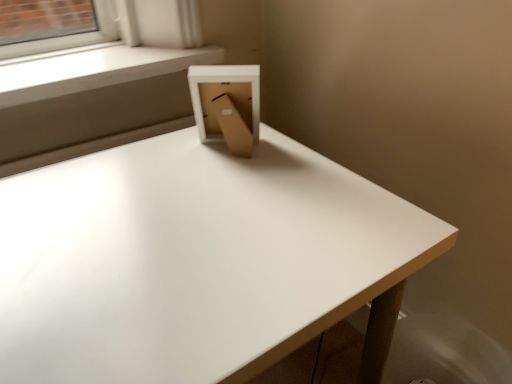
Locate an element on the screen. Image resolution: width=512 pixels, height=384 pixels. white smooth window sill at upper left is located at coordinates (94, 70).

Measure the distance between white smooth window sill at upper left and camera.

white smooth window sill at upper left and camera are 36.36 inches apart from each other.

In order to face cardboard box at center, should I rotate leftwards or rightwards?

To align with it, rotate left about 3.703°.

Identify the location of white smooth window sill at upper left. (94, 70).

Which is more distant, (18, 289) or (84, 84)?

Point (84, 84)

From the picture: Considering the relative positions of white matte table at center and white smooth window sill at upper left in the image provided, is white matte table at center to the left or to the right of white smooth window sill at upper left?

white matte table at center is to the right of white smooth window sill at upper left.

Can you confirm if white matte table at center is taller than white smooth window sill at upper left?

Indeed, white matte table at center has a greater height compared to white smooth window sill at upper left.

How many degrees apart are the facing directions of cardboard box at center and white smooth window sill at upper left?

143 degrees separate the facing orientations of cardboard box at center and white smooth window sill at upper left.

Is cardboard box at center next to white smooth window sill at upper left and touching it?

cardboard box at center is not next to white smooth window sill at upper left, and they're not touching.

Which is in front, point (205, 132) or point (95, 50)?

The point (205, 132) is closer.

Is cardboard box at center situated inside white smooth window sill at upper left or outside?

cardboard box at center cannot be found inside white smooth window sill at upper left.

In the scene shown: Does white smooth window sill at upper left come in front of white matte table at center?

No, white smooth window sill at upper left is further to the viewer.

Between white smooth window sill at upper left and white matte table at center, which one has smaller width?

Thinner between the two is white smooth window sill at upper left.

Is white smooth window sill at upper left smaller than white matte table at center?

Yes.

Is white smooth window sill at upper left not near cardboard box at center?

No, white smooth window sill at upper left is in close proximity to cardboard box at center.

Is point (84, 53) closer to viewer compared to point (206, 93)?

No, (84, 53) is behind (206, 93).

From the image's perspective, is white smooth window sill at upper left positioned above or below cardboard box at center?

Clearly, from the image's perspective, white smooth window sill at upper left is above cardboard box at center.

Between white smooth window sill at upper left and cardboard box at center, which one has more height?

Standing taller between the two is cardboard box at center.

What's the angular difference between cardboard box at center and white matte table at center's facing directions?

They differ by 142 degrees in their facing directions.

Which is behind, point (253, 129) or point (158, 240)?

The point (253, 129) is farther from the camera.

Is cardboard box at center shorter than white matte table at center?

Indeed, cardboard box at center has a lesser height compared to white matte table at center.

Is cardboard box at center far from white matte table at center?

cardboard box at center is actually quite close to white matte table at center.

Where is `cardboard box behind the white matte table at center`? cardboard box behind the white matte table at center is located at coordinates (227, 105).

Is white matte table at center not close to cardboard box at center?

That's not correct — white matte table at center is a little close to cardboard box at center.

Considering the relative positions of white matte table at center and cardboard box at center in the image provided, is white matte table at center behind cardboard box at center?

No, white matte table at center is closer to the camera.

What are the coordinates of `table that is in front of the white smooth window sill at upper left` in the screenshot? It's located at (192, 259).

This screenshot has width=512, height=384. In order to click on window sill above the cardboard box at center (from the image's perspective) in this screenshot , I will do `click(94, 70)`.

When comparing their distances from white matte table at center, does cardboard box at center or white smooth window sill at upper left seem closer?

Based on the image, cardboard box at center appears to be nearer to white matte table at center.

Considering their positions, is white matte table at center positioned closer to white smooth window sill at upper left than cardboard box at center?

cardboard box at center is positioned closer to the anchor white smooth window sill at upper left.

When comparing their distances from white smooth window sill at upper left, does cardboard box at center or white matte table at center seem closer?

cardboard box at center.

From the image, which object appears to be farther from cardboard box at center, white smooth window sill at upper left or white matte table at center?

Based on the image, white smooth window sill at upper left appears to be further to cardboard box at center.

When comparing their distances from white matte table at center, does white smooth window sill at upper left or cardboard box at center seem closer?

The object closer to white matte table at center is cardboard box at center.

Which object lies nearer to the anchor point cardboard box at center, white matte table at center or white smooth window sill at upper left?

white matte table at center is closer to cardboard box at center.

In order to click on cardboard box between white smooth window sill at upper left and white matte table at center from top to bottom in this screenshot , I will do `click(227, 105)`.